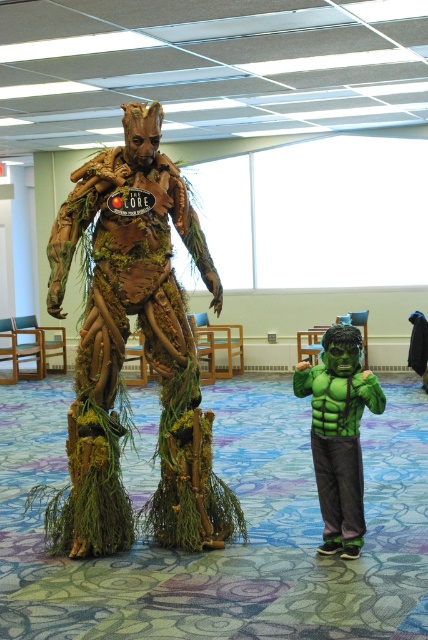
How distant is wooden textured tree-like figure at center from green matte hulk costume at lower right?

wooden textured tree-like figure at center is 38.21 inches away from green matte hulk costume at lower right.

Based on the photo, is wooden textured tree-like figure at center smaller than green matte hulk costume at lower right?

Actually, wooden textured tree-like figure at center might be larger than green matte hulk costume at lower right.

Is point (187, 456) farther from viewer compared to point (344, 509)?

That is True.

Where is `wooden textured tree-like figure at center`? The height and width of the screenshot is (640, 428). wooden textured tree-like figure at center is located at coordinates (145, 349).